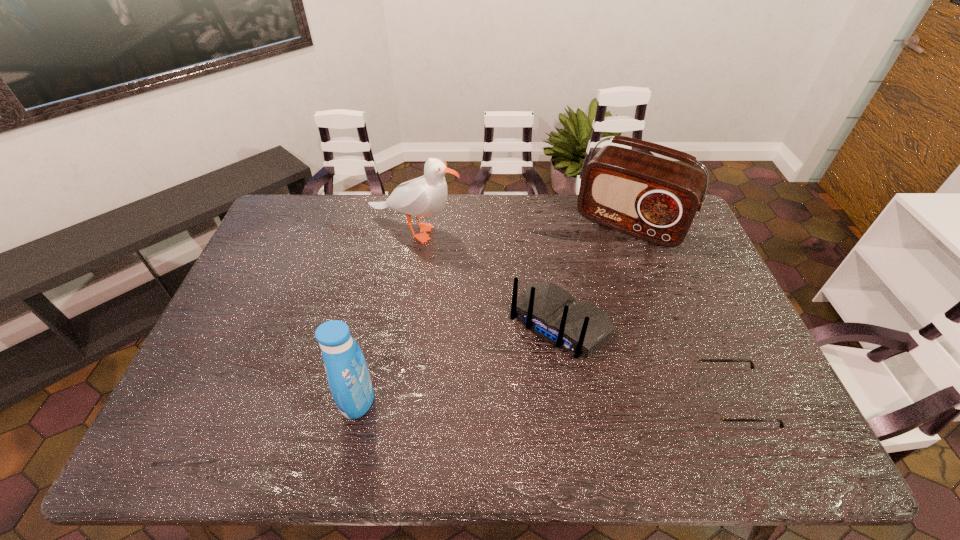
Find the location of `vacant space located at the hinge ends of the shortest object`. vacant space located at the hinge ends of the shortest object is located at coordinates (635, 399).

Identify the location of blank area located 0.330m at the hinge ends of the shortest object. The image size is (960, 540). (565, 399).

You are a GUI agent. You are given a task and a screenshot of the screen. Output one action in this format:
    pyautogui.click(x=<x>, y=<y>)
    Task: Click on the free region located 0.090m at the beak of the gull
    This screenshot has height=540, width=960.
    Given the screenshot: What is the action you would take?
    pyautogui.click(x=460, y=259)

The height and width of the screenshot is (540, 960). I want to click on vacant space located at the beak of the gull, so click(x=506, y=300).

Identify the location of free space located 0.210m at the beak of the gull. (483, 280).

You are a GUI agent. You are given a task and a screenshot of the screen. Output one action in this format:
    pyautogui.click(x=<x>, y=<y>)
    Task: Click on the vacant point located 0.090m on the front panel of the radio receiver
    This screenshot has width=960, height=540.
    Given the screenshot: What is the action you would take?
    pyautogui.click(x=599, y=265)

The image size is (960, 540). I want to click on vacant region located on the front panel of the radio receiver, so click(x=592, y=276).

I want to click on free space located 0.120m on the front panel of the radio receiver, so click(596, 270).

The height and width of the screenshot is (540, 960). What are the coordinates of `vacant space located on the back of the router` in the screenshot? It's located at (500, 393).

This screenshot has height=540, width=960. I want to click on free space located on the back of the router, so click(486, 410).